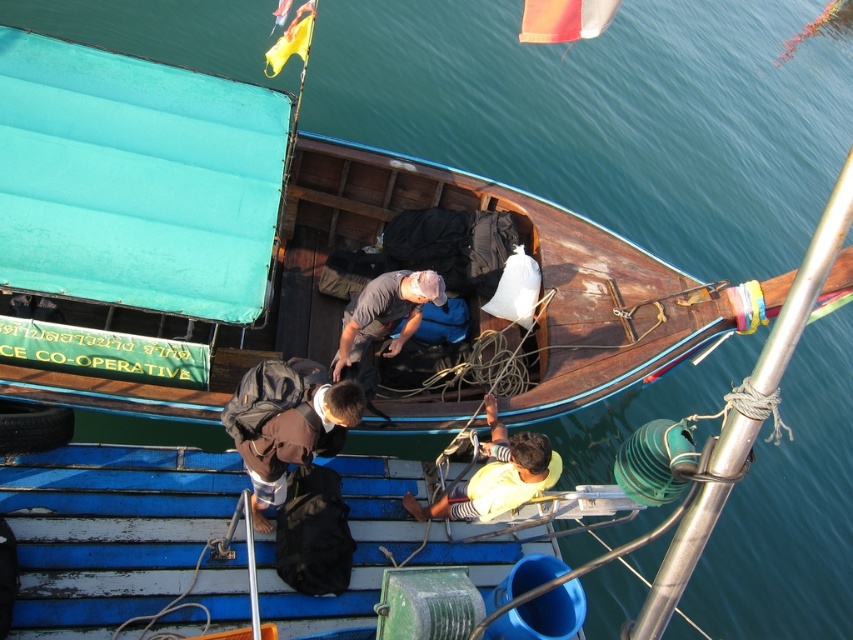
You are a fashion designer observing two shirts in a catalog. The yellow matte shirt at center and the gray matte shirt at center. Which shirt is wider?

The yellow matte shirt at center is wider than the gray matte shirt at center according to the description.

In the scene shown: You are a sailor on the traditional wooden boat and need to hand a tool to the person in the gray matte shirt at center. The person in the yellow matte shirt at center is blocking your path. Which direction should you move to go around them?

The yellow matte shirt at center is positioned on the right side of gray matte shirt at center. To avoid the yellow matte shirt at center, you should move to the left side of the gray matte shirt at center.